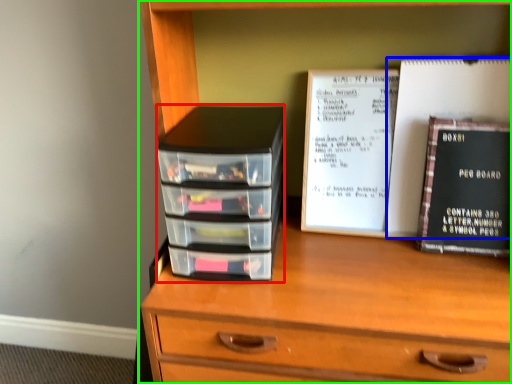
Question: Based on their relative distances, which object is farther from stack (highlighted by a red box)? Choose from paperback book (highlighted by a blue box) and chest of drawers (highlighted by a green box).

Choices:
 (A) paperback book
 (B) chest of drawers

Answer: (A)